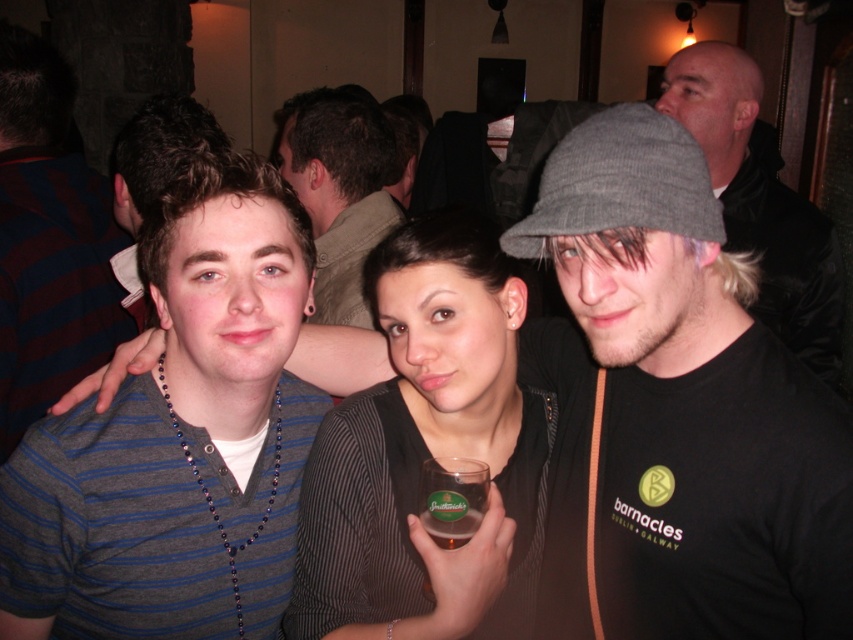
Question: Is black matte hat at upper right above striped cotton shirt at left?

Choices:
 (A) no
 (B) yes

Answer: (A)

Question: Is striped cotton shirt at center smaller than striped cotton shirt at left?

Choices:
 (A) no
 (B) yes

Answer: (B)

Question: Can you confirm if striped cotton shirt at center is smaller than matte brown shirt at center?

Choices:
 (A) yes
 (B) no

Answer: (A)

Question: Which point is closer to the camera?

Choices:
 (A) (538, 461)
 (B) (755, 227)
 (C) (282, 536)

Answer: (C)

Question: Among these objects, which one is farthest from the camera?

Choices:
 (A) striped shirt at center
 (B) striped cotton shirt at left
 (C) striped cotton shirt at center

Answer: (B)

Question: Among these points, which one is farthest from the camera?

Choices:
 (A) (813, 349)
 (B) (94, 332)

Answer: (B)